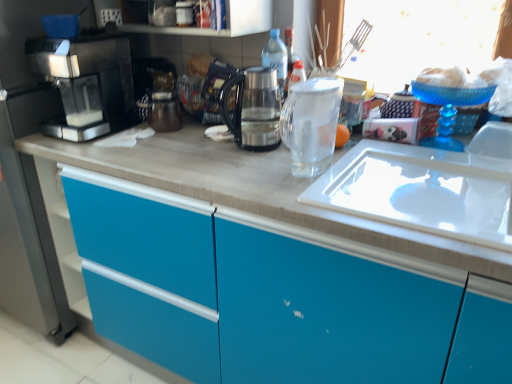
Locate an element on the screen. This screenshot has height=384, width=512. vacant area that lies in front of clear glass pitcher at center, the 2th kitchen appliance in the left-to-right sequence is located at coordinates (329, 195).